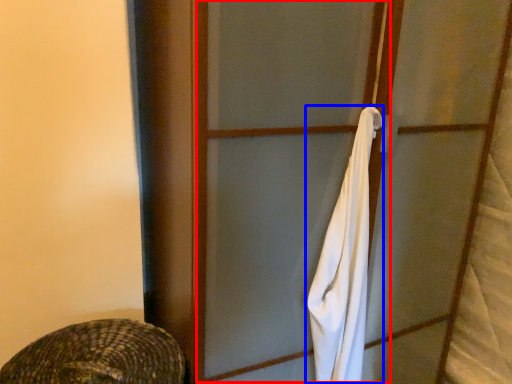
Question: Among these objects, which one is nearest to the camera, screen door (highlighted by a red box) or towel/napkin (highlighted by a blue box)?

Choices:
 (A) screen door
 (B) towel/napkin

Answer: (A)